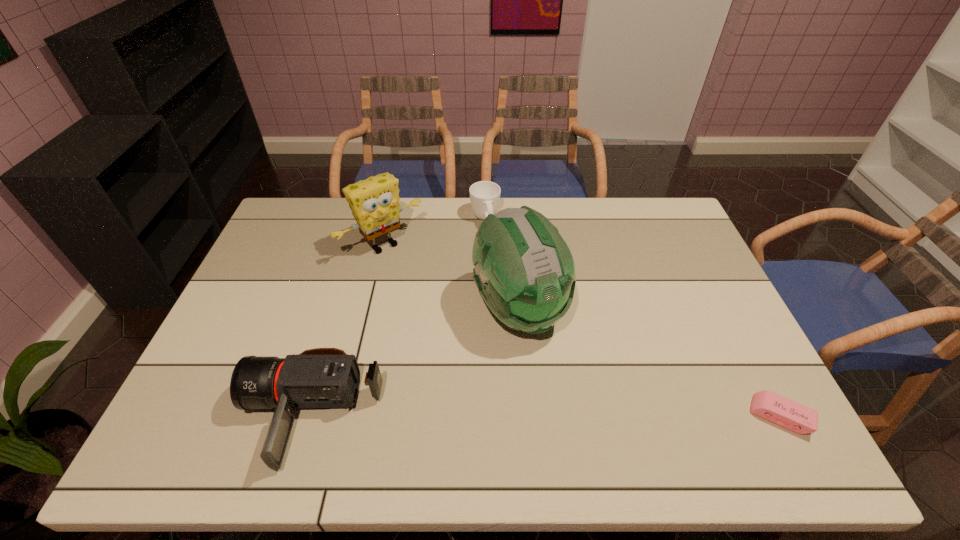
Where is `vacant spot on the desktop that is between the camcorder and the rightmost object and is positioned on the face of the fourth shortest object`? The width and height of the screenshot is (960, 540). vacant spot on the desktop that is between the camcorder and the rightmost object and is positioned on the face of the fourth shortest object is located at coordinates (540, 416).

Where is `vacant space on the desktop that is between the camcorder and the rightmost object and is positioned on the visor of the third farthest object`? The height and width of the screenshot is (540, 960). vacant space on the desktop that is between the camcorder and the rightmost object and is positioned on the visor of the third farthest object is located at coordinates (584, 416).

Identify the location of vacant space on the desktop that is between the camcorder and the rightmost object and is positioned with the handle on the side of the cup. (555, 416).